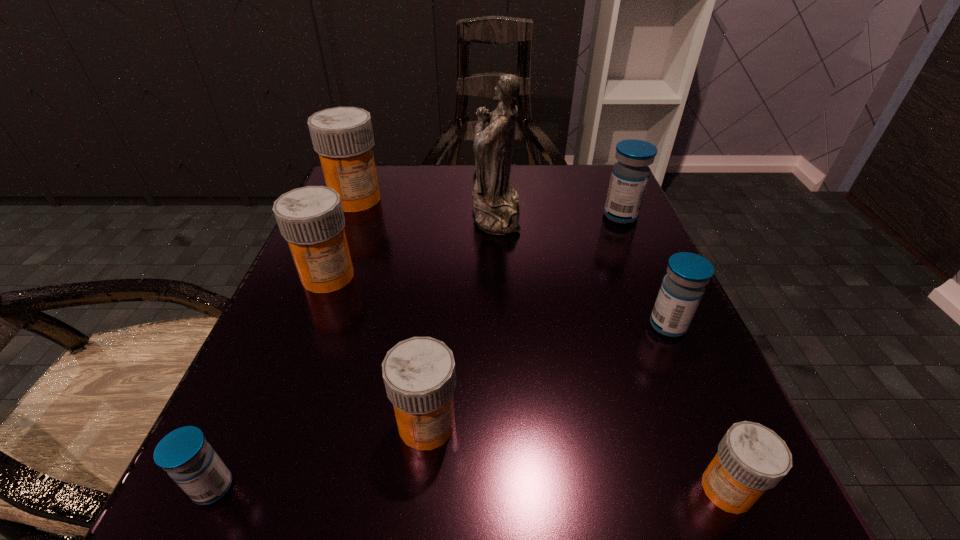
Find the location of a particular element. The image size is (960, 540). the fourth nearest medicine is located at coordinates (682, 288).

Image resolution: width=960 pixels, height=540 pixels. In order to click on the nearest orange medicine in this screenshot , I will do `click(751, 458)`.

Identify the location of the rightmost orange medicine. (751, 458).

The height and width of the screenshot is (540, 960). What are the coordinates of `the leftmost blue medicine` in the screenshot? It's located at (184, 453).

This screenshot has height=540, width=960. I want to click on the smallest blue medicine, so click(184, 453).

This screenshot has width=960, height=540. In order to click on vacant region located on the front-facing side of the tallest object in this screenshot , I will do `click(351, 214)`.

This screenshot has height=540, width=960. I want to click on blank space located on the front-facing side of the tallest object, so click(443, 214).

Locate an element on the screen. This screenshot has width=960, height=540. vacant space located on the front-facing side of the tallest object is located at coordinates (423, 214).

Locate an element on the screen. The image size is (960, 540). vacant position located 0.190m on the label side of the biggest orange medicine is located at coordinates (326, 273).

The height and width of the screenshot is (540, 960). I want to click on free region located on the front of the biggest blue medicine, so click(x=648, y=279).